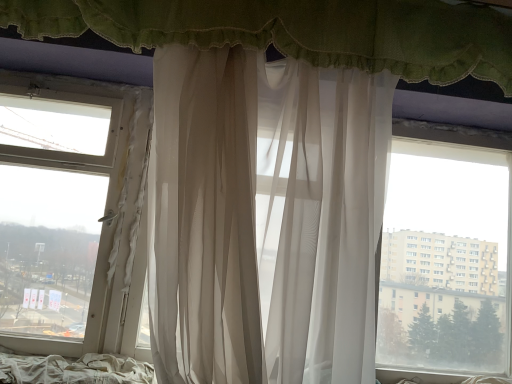
Question: Considering the positions of sheer white curtain at upper center, acting as the 2th curtain starting from the bottom, and white fabric bed at lower left in the image, is sheer white curtain at upper center, acting as the 2th curtain starting from the bottom, taller or shorter than white fabric bed at lower left?

Choices:
 (A) short
 (B) tall

Answer: (B)

Question: Would you say sheer white curtain at upper center, arranged as the 1th curtain when viewed from the top, is inside or outside white fabric bed at lower left?

Choices:
 (A) inside
 (B) outside

Answer: (B)

Question: Which object is the farthest from the sheer white curtain at upper center, arranged as the 1th curtain when viewed from the top?

Choices:
 (A) sheer white curtain at center, the first curtain ordered from the bottom
 (B) white fabric bed at lower left

Answer: (B)

Question: Based on their relative distances, which object is farther from the sheer white curtain at upper center, acting as the 2th curtain starting from the bottom?

Choices:
 (A) white fabric bed at lower left
 (B) sheer white curtain at center, marked as the 2th curtain in a top-to-bottom arrangement

Answer: (A)